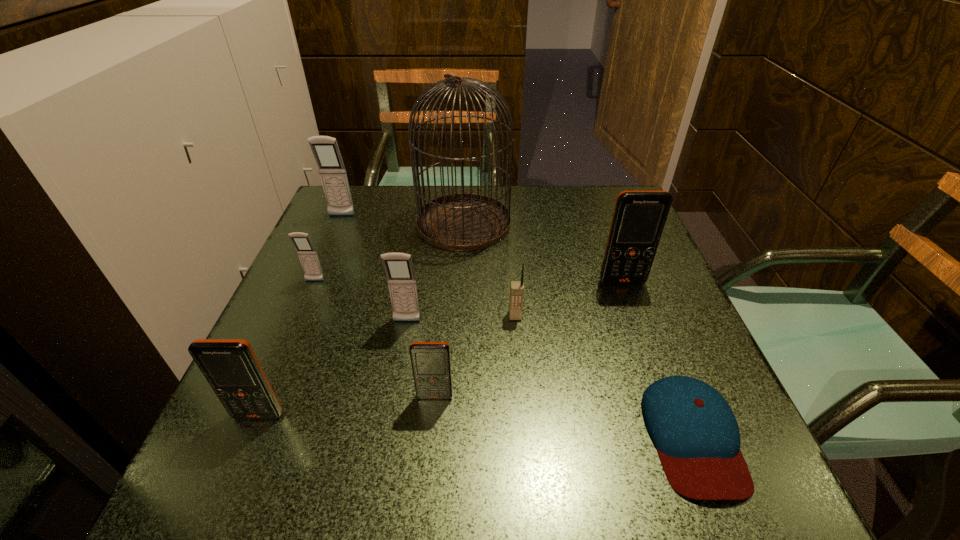
The image size is (960, 540). Find the location of `empty location between the second farthest orange cellular telephone and the rightmost cellular telephone`. empty location between the second farthest orange cellular telephone and the rightmost cellular telephone is located at coordinates (529, 339).

Find the location of a particular element. This screenshot has width=960, height=540. vacant area that lies between the birdcage and the leftmost orange cellular telephone is located at coordinates (361, 319).

I want to click on vacant point located between the second biggest gray cellular telephone and the smallest gray cellular telephone, so click(x=361, y=301).

Where is `free space between the sixth cellular telephone from left to right and the second biggest orange cellular telephone`? free space between the sixth cellular telephone from left to right and the second biggest orange cellular telephone is located at coordinates (387, 366).

Find the location of `object that is the second closest to the sixth farthest cellular telephone`. object that is the second closest to the sixth farthest cellular telephone is located at coordinates (516, 287).

Where is `the fifth closest object to the rightmost gray cellular telephone`? the fifth closest object to the rightmost gray cellular telephone is located at coordinates (230, 366).

Locate an element on the screen. The width and height of the screenshot is (960, 540). the sixth closest cellular telephone relative to the farthest gray cellular telephone is located at coordinates (639, 217).

Identify which cellular telephone is the third closest to the smallest gray cellular telephone. Please provide its 2D coordinates. Your answer should be formatted as a tuple, i.e. [(x, y)], where the tuple contains the x and y coordinates of a point satisfying the conditions above.

[(230, 366)]

Locate which gray cellular telephone ranks second in proximity to the second nearest gray cellular telephone. Please provide its 2D coordinates. Your answer should be formatted as a tuple, i.e. [(x, y)], where the tuple contains the x and y coordinates of a point satisfying the conditions above.

[(325, 149)]

Identify which gray cellular telephone is the third closest to the biggest orange cellular telephone. Please provide its 2D coordinates. Your answer should be formatted as a tuple, i.e. [(x, y)], where the tuple contains the x and y coordinates of a point satisfying the conditions above.

[(325, 149)]